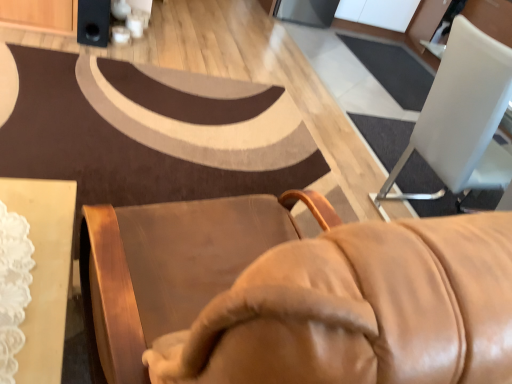
Find the location of `free space in front of black matte speaker at upper left`. free space in front of black matte speaker at upper left is located at coordinates (75, 39).